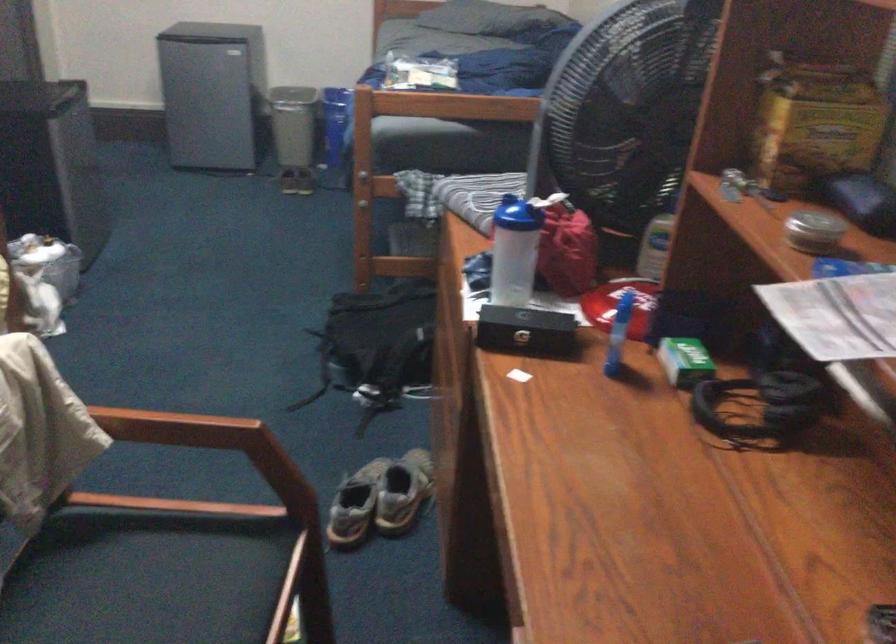
Find the location of a particular element. The height and width of the screenshot is (644, 896). wooden chair armrest is located at coordinates (176, 428).